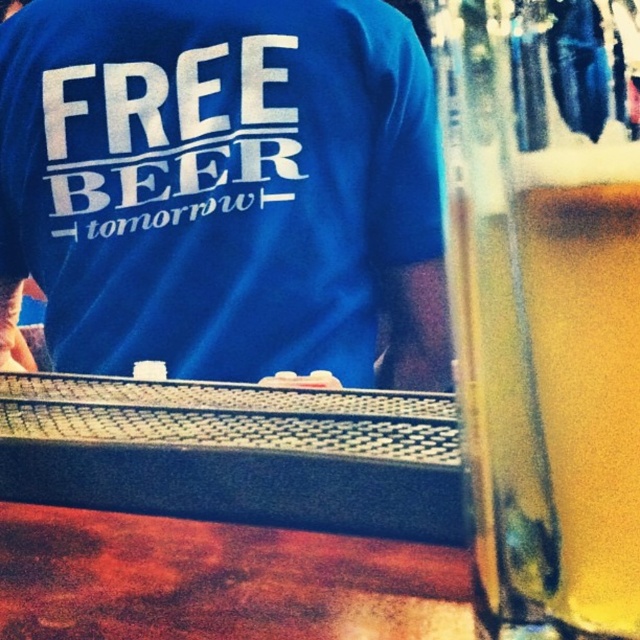
You are a photographer who wants to capture the blue cotton t shirt at upper left in focus while blurring the background. Given that the blue cotton t shirt at upper left is located at point (230, 198), where should you focus your camera?

The blue cotton t shirt at upper left is located at point (230, 198), so you should focus your camera at that point to keep the blue cotton t shirt at upper left sharp while blurring the background.